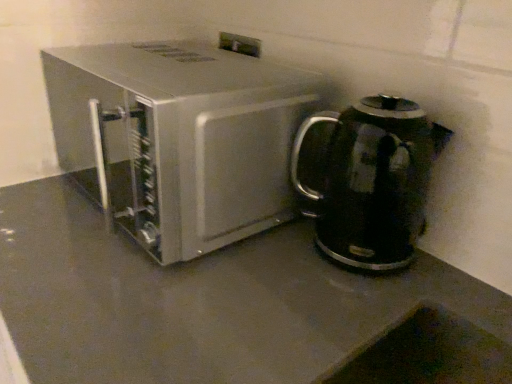
What do you see at coordinates (371, 181) in the screenshot?
I see `black glossy electric kettle at right, which appears as the first kitchen appliance when viewed from the right` at bounding box center [371, 181].

Where is `black glossy electric kettle at right, which is the second kitchen appliance from left to right`? Image resolution: width=512 pixels, height=384 pixels. black glossy electric kettle at right, which is the second kitchen appliance from left to right is located at coordinates (371, 181).

In order to face black glossy electric kettle at right, which appears as the first kitchen appliance when viewed from the right, should I rotate leftwards or rightwards?

Rotate your view right by about 15.414°.

This screenshot has height=384, width=512. Describe the element at coordinates (180, 139) in the screenshot. I see `satin silver microwave at center, the first kitchen appliance from the left` at that location.

Image resolution: width=512 pixels, height=384 pixels. In order to click on satin silver microwave at center, acting as the second kitchen appliance starting from the right in this screenshot , I will do `click(180, 139)`.

Locate an element on the screen. The height and width of the screenshot is (384, 512). black glossy electric kettle at right, which is the second kitchen appliance from left to right is located at coordinates (371, 181).

Which object is positioned more to the left, black glossy electric kettle at right, which appears as the first kitchen appliance when viewed from the right, or satin silver microwave at center, the first kitchen appliance from the left?

From the viewer's perspective, satin silver microwave at center, the first kitchen appliance from the left, appears more on the left side.

Is black glossy electric kettle at right, which is the second kitchen appliance from left to right, positioned behind satin silver microwave at center, acting as the second kitchen appliance starting from the right?

Yes, black glossy electric kettle at right, which is the second kitchen appliance from left to right, is further from the viewer.

Is point (364, 179) positioned after point (272, 130)?

Yes, point (364, 179) is farther from viewer.

From the image's perspective, is black glossy electric kettle at right, which is the second kitchen appliance from left to right, located above or below satin silver microwave at center, the first kitchen appliance from the left?

Clearly, from the image's perspective, black glossy electric kettle at right, which is the second kitchen appliance from left to right, is below satin silver microwave at center, the first kitchen appliance from the left.

From a real-world perspective, is black glossy electric kettle at right, which appears as the first kitchen appliance when viewed from the right, below satin silver microwave at center, the first kitchen appliance from the left?

Indeed, from a real-world perspective, black glossy electric kettle at right, which appears as the first kitchen appliance when viewed from the right, is positioned beneath satin silver microwave at center, the first kitchen appliance from the left.

Does black glossy electric kettle at right, which is the second kitchen appliance from left to right, have a lesser width compared to satin silver microwave at center, the first kitchen appliance from the left?

Indeed, black glossy electric kettle at right, which is the second kitchen appliance from left to right, has a lesser width compared to satin silver microwave at center, the first kitchen appliance from the left.

Considering the sizes of objects black glossy electric kettle at right, which is the second kitchen appliance from left to right, and satin silver microwave at center, acting as the second kitchen appliance starting from the right, in the image provided, who is shorter, black glossy electric kettle at right, which is the second kitchen appliance from left to right, or satin silver microwave at center, acting as the second kitchen appliance starting from the right,?

Standing shorter between the two is black glossy electric kettle at right, which is the second kitchen appliance from left to right.

Who is smaller, black glossy electric kettle at right, which appears as the first kitchen appliance when viewed from the right, or satin silver microwave at center, the first kitchen appliance from the left?

With smaller size is black glossy electric kettle at right, which appears as the first kitchen appliance when viewed from the right.

Is black glossy electric kettle at right, which is the second kitchen appliance from left to right, not inside satin silver microwave at center, the first kitchen appliance from the left?

Yes, black glossy electric kettle at right, which is the second kitchen appliance from left to right, is located beyond the bounds of satin silver microwave at center, the first kitchen appliance from the left.

Does black glossy electric kettle at right, which is the second kitchen appliance from left to right, touch satin silver microwave at center, the first kitchen appliance from the left?

No, black glossy electric kettle at right, which is the second kitchen appliance from left to right, is not with satin silver microwave at center, the first kitchen appliance from the left.

Is black glossy electric kettle at right, which appears as the first kitchen appliance when viewed from the right, turned away from satin silver microwave at center, the first kitchen appliance from the left?

No.

What's the angular difference between black glossy electric kettle at right, which is the second kitchen appliance from left to right, and satin silver microwave at center, the first kitchen appliance from the left,'s facing directions?

2.37 degrees separate the facing orientations of black glossy electric kettle at right, which is the second kitchen appliance from left to right, and satin silver microwave at center, the first kitchen appliance from the left.

The width and height of the screenshot is (512, 384). I want to click on kitchen appliance that appears on the right of satin silver microwave at center, acting as the second kitchen appliance starting from the right, so click(x=371, y=181).

Based on their positions, is satin silver microwave at center, acting as the second kitchen appliance starting from the right, located to the left or right of black glossy electric kettle at right, which is the second kitchen appliance from left to right?

Clearly, satin silver microwave at center, acting as the second kitchen appliance starting from the right, is on the left of black glossy electric kettle at right, which is the second kitchen appliance from left to right, in the image.

Considering the relative positions of satin silver microwave at center, acting as the second kitchen appliance starting from the right, and black glossy electric kettle at right, which is the second kitchen appliance from left to right, in the image provided, is satin silver microwave at center, acting as the second kitchen appliance starting from the right, behind black glossy electric kettle at right, which is the second kitchen appliance from left to right,?

No, satin silver microwave at center, acting as the second kitchen appliance starting from the right, is closer to the viewer.

Does point (238, 108) come closer to viewer compared to point (340, 123)?

Yes, it is in front of point (340, 123).

From the image's perspective, between satin silver microwave at center, the first kitchen appliance from the left, and black glossy electric kettle at right, which is the second kitchen appliance from left to right, which one is located above?

satin silver microwave at center, the first kitchen appliance from the left.

From a real-world perspective, is satin silver microwave at center, the first kitchen appliance from the left, over black glossy electric kettle at right, which appears as the first kitchen appliance when viewed from the right?

Yes, from a real-world perspective, satin silver microwave at center, the first kitchen appliance from the left, is above black glossy electric kettle at right, which appears as the first kitchen appliance when viewed from the right.

Can you confirm if satin silver microwave at center, acting as the second kitchen appliance starting from the right, is thinner than black glossy electric kettle at right, which is the second kitchen appliance from left to right?

In fact, satin silver microwave at center, acting as the second kitchen appliance starting from the right, might be wider than black glossy electric kettle at right, which is the second kitchen appliance from left to right.

Is satin silver microwave at center, the first kitchen appliance from the left, taller or shorter than black glossy electric kettle at right, which appears as the first kitchen appliance when viewed from the right?

Considering their sizes, satin silver microwave at center, the first kitchen appliance from the left, has more height than black glossy electric kettle at right, which appears as the first kitchen appliance when viewed from the right.

Is satin silver microwave at center, acting as the second kitchen appliance starting from the right, bigger or smaller than black glossy electric kettle at right, which is the second kitchen appliance from left to right?

In the image, satin silver microwave at center, acting as the second kitchen appliance starting from the right, appears to be larger than black glossy electric kettle at right, which is the second kitchen appliance from left to right.

Is satin silver microwave at center, acting as the second kitchen appliance starting from the right, completely or partially outside of black glossy electric kettle at right, which appears as the first kitchen appliance when viewed from the right?

Indeed, satin silver microwave at center, acting as the second kitchen appliance starting from the right, is completely outside black glossy electric kettle at right, which appears as the first kitchen appliance when viewed from the right.

Does satin silver microwave at center, acting as the second kitchen appliance starting from the right, touch black glossy electric kettle at right, which appears as the first kitchen appliance when viewed from the right?

No, satin silver microwave at center, acting as the second kitchen appliance starting from the right, is not next to black glossy electric kettle at right, which appears as the first kitchen appliance when viewed from the right.

Could you tell me if satin silver microwave at center, acting as the second kitchen appliance starting from the right, is turned towards black glossy electric kettle at right, which appears as the first kitchen appliance when viewed from the right?

No, satin silver microwave at center, acting as the second kitchen appliance starting from the right, is not oriented towards black glossy electric kettle at right, which appears as the first kitchen appliance when viewed from the right.

How different are the orientations of satin silver microwave at center, the first kitchen appliance from the left, and black glossy electric kettle at right, which appears as the first kitchen appliance when viewed from the right, in degrees?

They differ by 2.37 degrees in their facing directions.

Could you measure the distance between satin silver microwave at center, acting as the second kitchen appliance starting from the right, and black glossy electric kettle at right, which is the second kitchen appliance from left to right?

satin silver microwave at center, acting as the second kitchen appliance starting from the right, and black glossy electric kettle at right, which is the second kitchen appliance from left to right, are 21.28 centimeters apart.

This screenshot has height=384, width=512. I want to click on kitchen appliance above the black glossy electric kettle at right, which is the second kitchen appliance from left to right (from a real-world perspective), so click(x=180, y=139).

Find the location of a particular element. kitchen appliance that is above the black glossy electric kettle at right, which appears as the first kitchen appliance when viewed from the right (from the image's perspective) is located at coordinates (180, 139).

Find the location of a particular element. This screenshot has height=384, width=512. kitchen appliance in front of the black glossy electric kettle at right, which appears as the first kitchen appliance when viewed from the right is located at coordinates (180, 139).